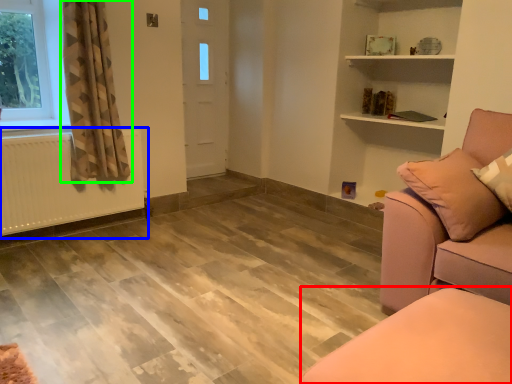
Question: Which object is positioned closest to furniture (highlighted by a red box)? Select from radiator (highlighted by a blue box) and curtain (highlighted by a green box).

Choices:
 (A) radiator
 (B) curtain

Answer: (B)